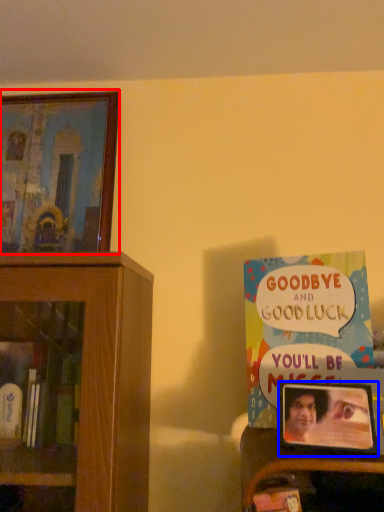
Question: Which point is further to the camera, picture frame (highlighted by a red box) or picture frame (highlighted by a blue box)?

Choices:
 (A) picture frame
 (B) picture frame

Answer: (A)